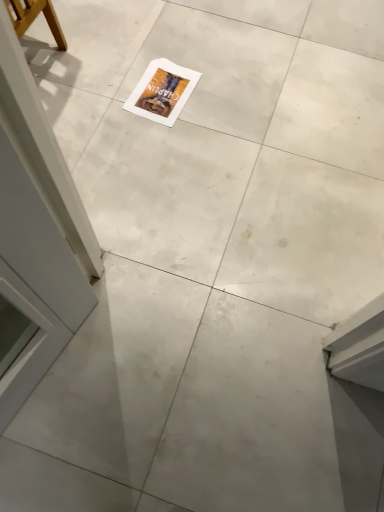
Identify the location of free space above white paper postcard at center (from a real-world perspective). Image resolution: width=384 pixels, height=512 pixels. [x=160, y=81].